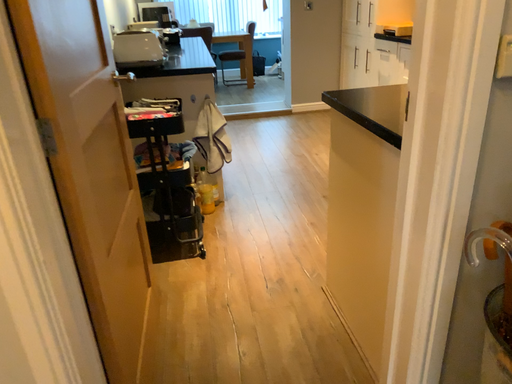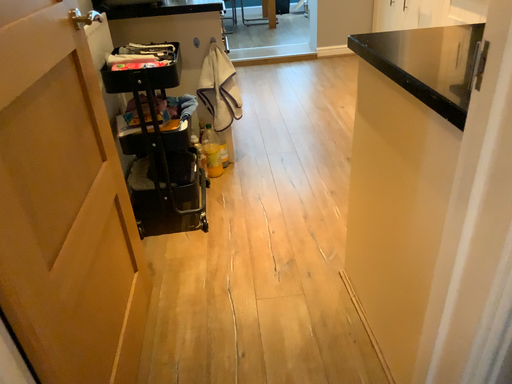
Question: How did the camera likely rotate when shooting the video?

Choices:
 (A) rotated downward
 (B) rotated upward

Answer: (A)